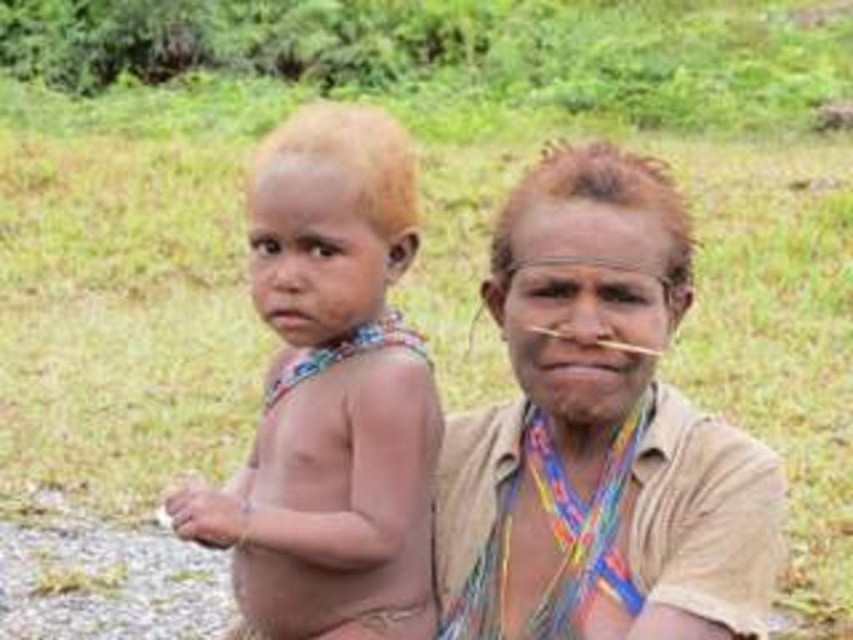
You are a photographer trying to capture the perfect shot of the two people in the scene. You want to ensure that both the brown textured cloth at center and the light brown hair at center are clearly visible in the frame. Given their sizes, which object should you focus on first to ensure it is in sharp focus?

The brown textured cloth at center is bigger than the light brown hair at center, so you should focus on the brown textured cloth at center first to ensure it is in sharp focus.

You are a photographer trying to capture a portrait of the two people in the image. You want to ensure that the brown textured cloth at center and the light brown hair at center are both clearly visible in the frame. Based on their positions, which object is closer to the camera?

The brown textured cloth at center is positioned under the light brown hair at center, meaning the light brown hair at center is closer to the camera since it is above the cloth.